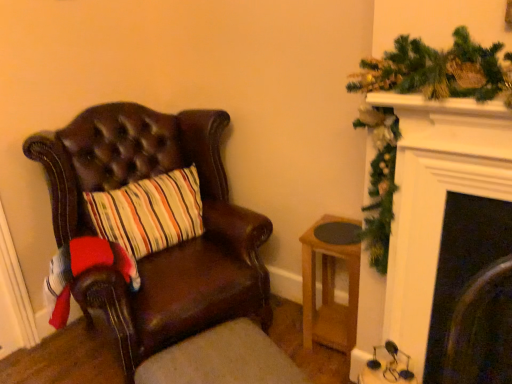
Question: Should I look upward or downward to see brown leather footrest at lower left?

Choices:
 (A) up
 (B) down

Answer: (B)

Question: From the image's perspective, is brown leather footrest at lower left located above leather chair at left?

Choices:
 (A) yes
 (B) no

Answer: (B)

Question: Considering the relative positions of brown leather footrest at lower left and leather chair at left in the image provided, is brown leather footrest at lower left to the right of leather chair at left from the viewer's perspective?

Choices:
 (A) yes
 (B) no

Answer: (A)

Question: Is the surface of brown leather footrest at lower left in direct contact with leather chair at left?

Choices:
 (A) no
 (B) yes

Answer: (A)

Question: Does brown leather footrest at lower left turn towards leather chair at left?

Choices:
 (A) no
 (B) yes

Answer: (A)

Question: Considering the relative sizes of brown leather footrest at lower left and leather chair at left in the image provided, is brown leather footrest at lower left shorter than leather chair at left?

Choices:
 (A) yes
 (B) no

Answer: (A)

Question: From a real-world perspective, is brown leather footrest at lower left positioned under leather chair at left based on gravity?

Choices:
 (A) yes
 (B) no

Answer: (A)

Question: From the image's perspective, is light brown wooden stool at lower right over brown leather footrest at lower left?

Choices:
 (A) no
 (B) yes

Answer: (B)

Question: From a real-world perspective, does light brown wooden stool at lower right sit lower than brown leather footrest at lower left?

Choices:
 (A) yes
 (B) no

Answer: (B)

Question: Considering the relative sizes of light brown wooden stool at lower right and brown leather footrest at lower left in the image provided, is light brown wooden stool at lower right thinner than brown leather footrest at lower left?

Choices:
 (A) yes
 (B) no

Answer: (A)

Question: Can we say light brown wooden stool at lower right lies outside brown leather footrest at lower left?

Choices:
 (A) no
 (B) yes

Answer: (B)

Question: Is light brown wooden stool at lower right in front of brown leather footrest at lower left?

Choices:
 (A) no
 (B) yes

Answer: (A)

Question: Is light brown wooden stool at lower right surrounding brown leather footrest at lower left?

Choices:
 (A) no
 (B) yes

Answer: (A)

Question: Is brown leather footrest at lower left thinner than light brown wooden stool at lower right?

Choices:
 (A) no
 (B) yes

Answer: (A)